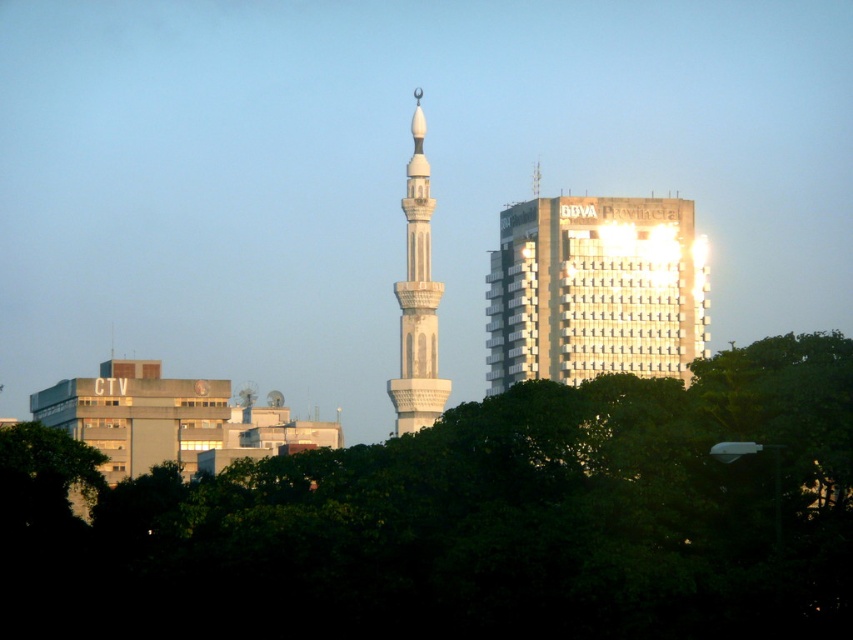
Who is taller, white glass building at upper center or white marble minaret at center?

white marble minaret at center is taller.

Does white glass building at upper center have a lesser height compared to white marble minaret at center?

Indeed, white glass building at upper center has a lesser height compared to white marble minaret at center.

Is point (670, 198) farther from camera compared to point (427, 250)?

Yes.

Identify the location of white glass building at upper center. The height and width of the screenshot is (640, 853). (595, 291).

Is green leafy tree at lower center thinner than white glass building at upper center?

No.

Is green leafy tree at lower center to the left of white glass building at upper center from the viewer's perspective?

Yes, green leafy tree at lower center is to the left of white glass building at upper center.

Is point (119, 563) positioned in front of point (651, 218)?

No, it is not.

Find the location of a particular element. The width and height of the screenshot is (853, 640). green leafy tree at lower center is located at coordinates (469, 522).

Is green leafy tree at lower center above white marble minaret at center?

No.

Is green leafy tree at lower center below white marble minaret at center?

Yes, green leafy tree at lower center is below white marble minaret at center.

Locate an element on the screen. green leafy tree at lower center is located at coordinates (469, 522).

Locate an element on the screen. This screenshot has width=853, height=640. green leafy tree at lower center is located at coordinates (469, 522).